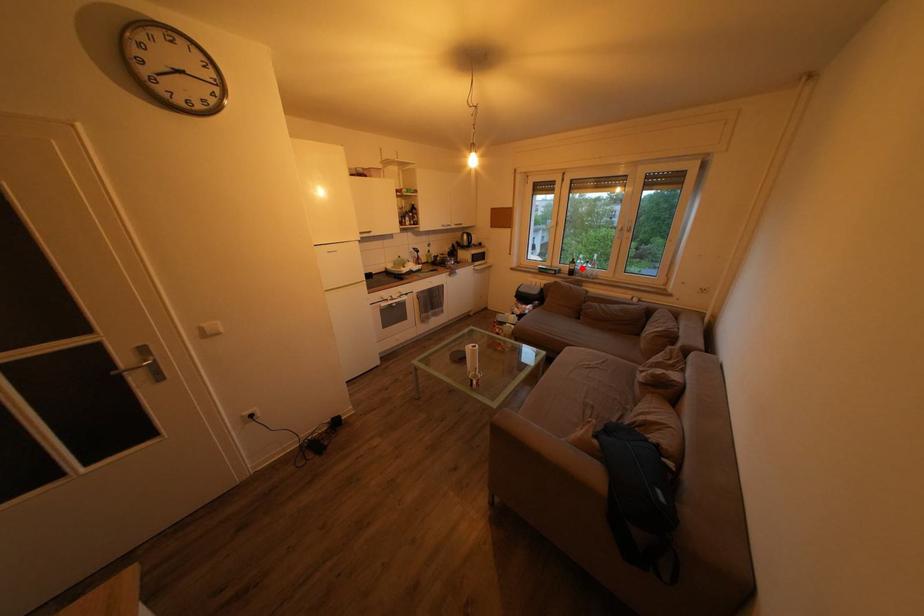
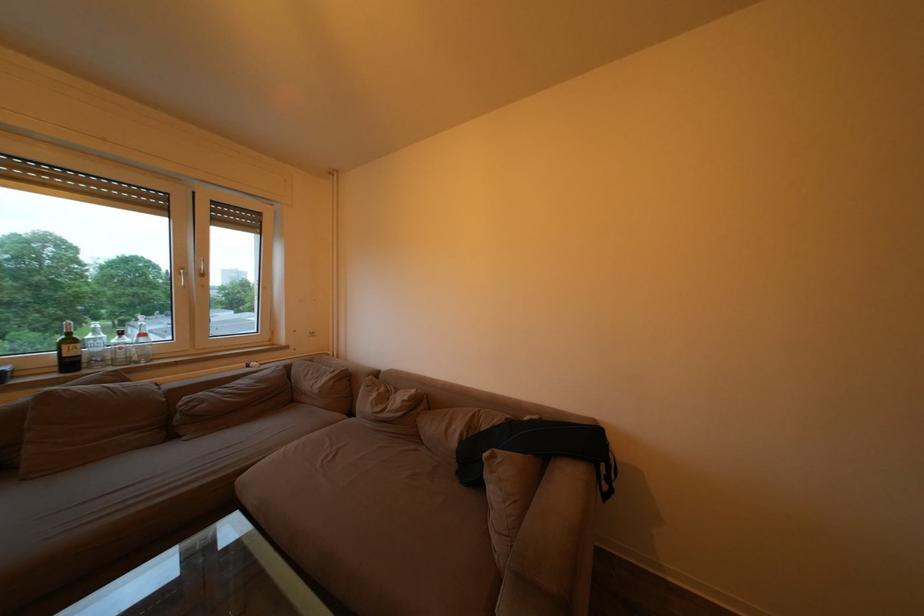
Question: A red point is marked in image1. In image2, is the corresponding 3D point closer to the camera or farther? Reply with the corresponding letter.

Choices:
 (A) The corresponding 3D point is closer.
 (B) The corresponding 3D point is farther.

Answer: (B)